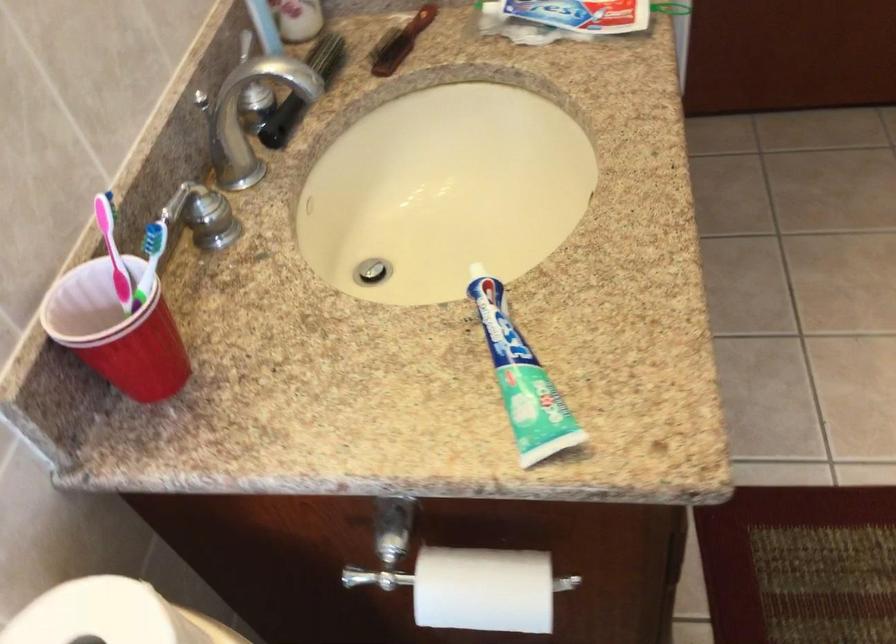
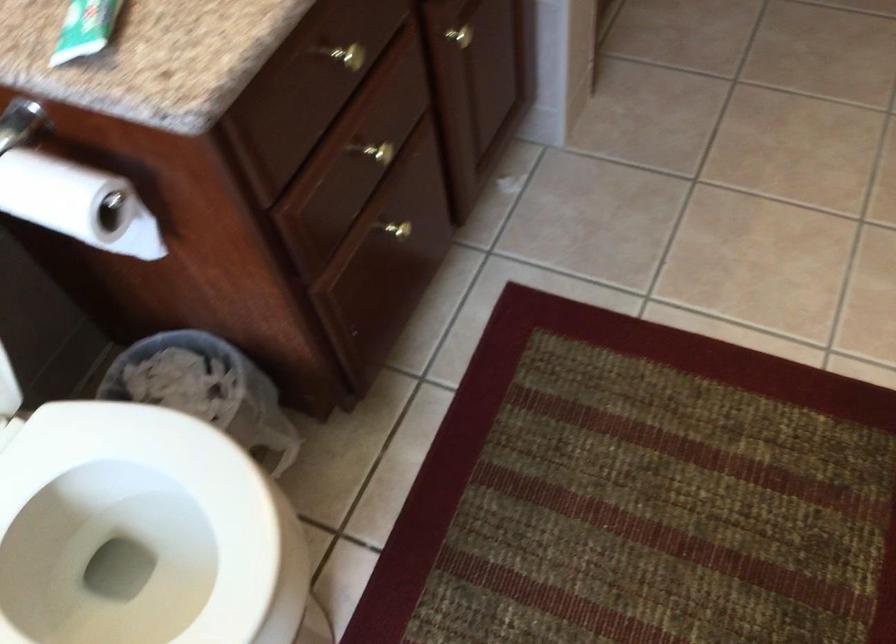
Question: Which direction would the cameraman need to move to produce the second image? Reply with the corresponding letter.

Choices:
 (A) Left
 (B) Right
 (C) Forward
 (D) Backward

Answer: (B)